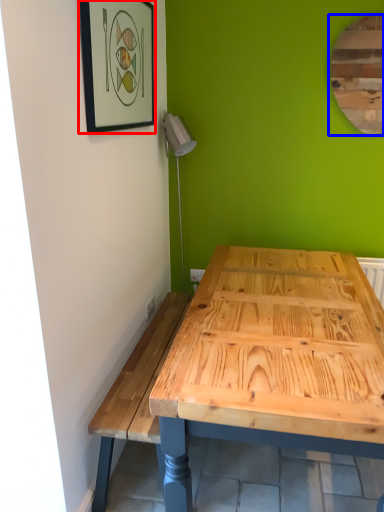
Question: Which of the following is the closest to the observer, picture frame (highlighted by a red box) or mirror (highlighted by a blue box)?

Choices:
 (A) picture frame
 (B) mirror

Answer: (A)